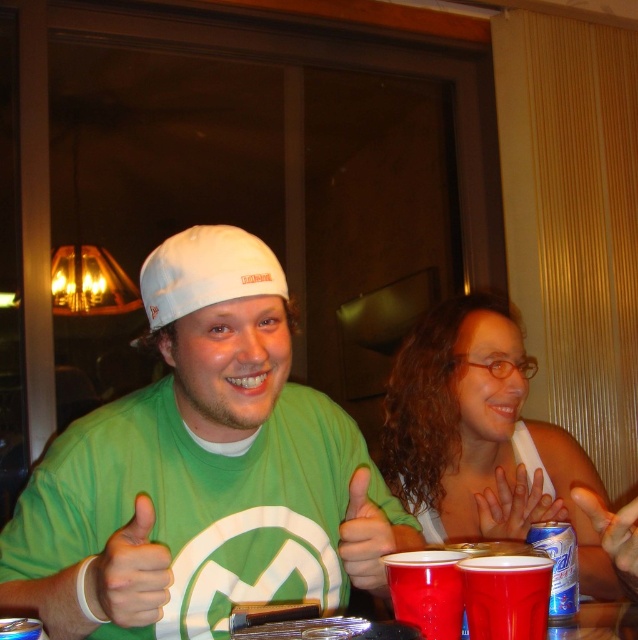
Locate an element on the screen. green matte hand at center is located at coordinates (130, 572).

Who is higher up, matte white hair at center or red plastic cup at center?

Positioned higher is matte white hair at center.

Is matte white hair at center to the right of red plastic cup at center from the viewer's perspective?

Yes, matte white hair at center is to the right of red plastic cup at center.

Where is `matte white hair at center`? The width and height of the screenshot is (638, 640). matte white hair at center is located at coordinates (482, 436).

Who is more forward, [225,547] or [517,604]?

Point [517,604] is more forward.

Who is shorter, matte white cap at center or red plastic cup at center?

Standing shorter between the two is red plastic cup at center.

Is point (82, 627) closer to camera compared to point (521, 573)?

No, (82, 627) is further to viewer.

Find the location of a particular element. The height and width of the screenshot is (640, 638). matte white cap at center is located at coordinates (195, 468).